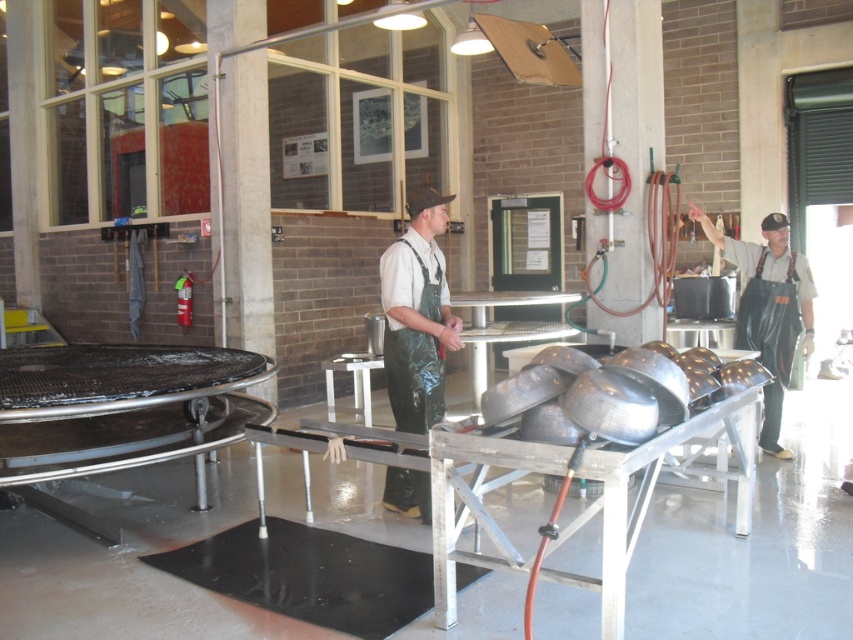
Can you confirm if green rubber apron at center is positioned to the left of black rubber apron at right?

Yes, green rubber apron at center is to the left of black rubber apron at right.

Does green rubber apron at center appear on the right side of black rubber apron at right?

No, green rubber apron at center is not to the right of black rubber apron at right.

Locate an element on the screen. Image resolution: width=853 pixels, height=640 pixels. green rubber apron at center is located at coordinates (416, 316).

The height and width of the screenshot is (640, 853). In order to click on green rubber apron at center in this screenshot , I will do `click(416, 316)`.